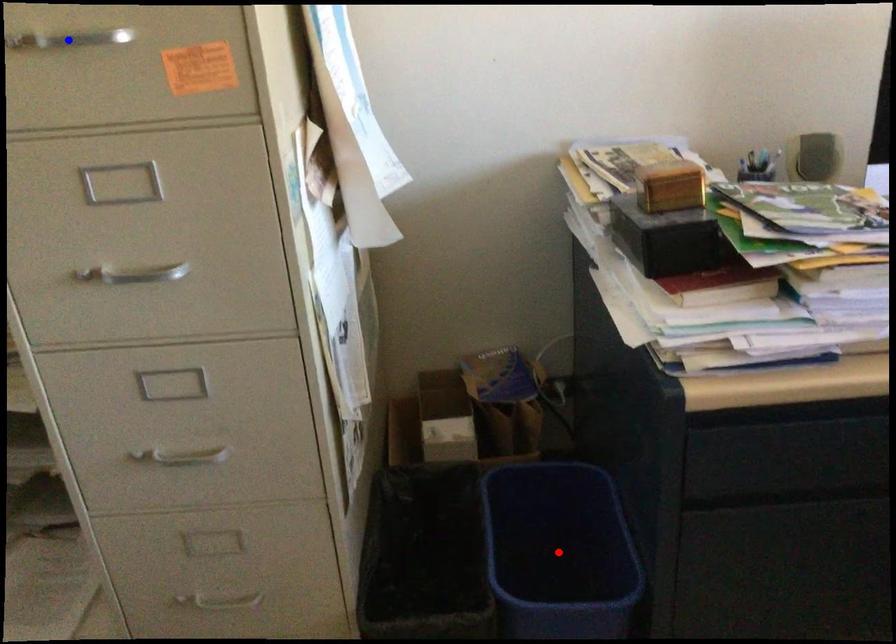
Question: In the image, two points are highlighted. Which point is nearer to the camera? Reply with the corresponding letter.

Choices:
 (A) blue point
 (B) red point

Answer: (A)